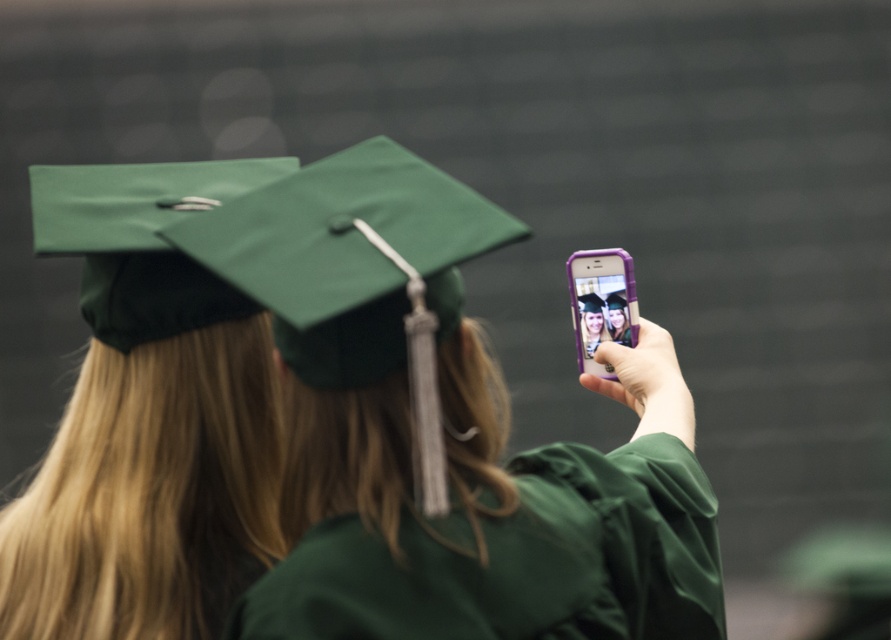
Question: Where is green matte graduation cap at upper left located in relation to green matte graduation robe at center in the image?

Choices:
 (A) left
 (B) right

Answer: (A)

Question: Is green matte graduation cap at center closer to camera compared to green matte graduation cap at upper left?

Choices:
 (A) no
 (B) yes

Answer: (B)

Question: Which of these objects is positioned closest to the green matte graduation robe at center?

Choices:
 (A) green matte graduation cap at upper left
 (B) green matte graduation cap at center

Answer: (B)

Question: Based on their relative distances, which object is nearer to the green matte graduation cap at upper left?

Choices:
 (A) green matte graduation cap at center
 (B) green matte graduation robe at center

Answer: (A)

Question: Can you confirm if green matte graduation cap at center is positioned to the left of green matte graduation robe at center?

Choices:
 (A) yes
 (B) no

Answer: (B)

Question: Which object is positioned farthest from the green matte graduation robe at center?

Choices:
 (A) green matte graduation cap at upper left
 (B) green matte graduation cap at center

Answer: (A)